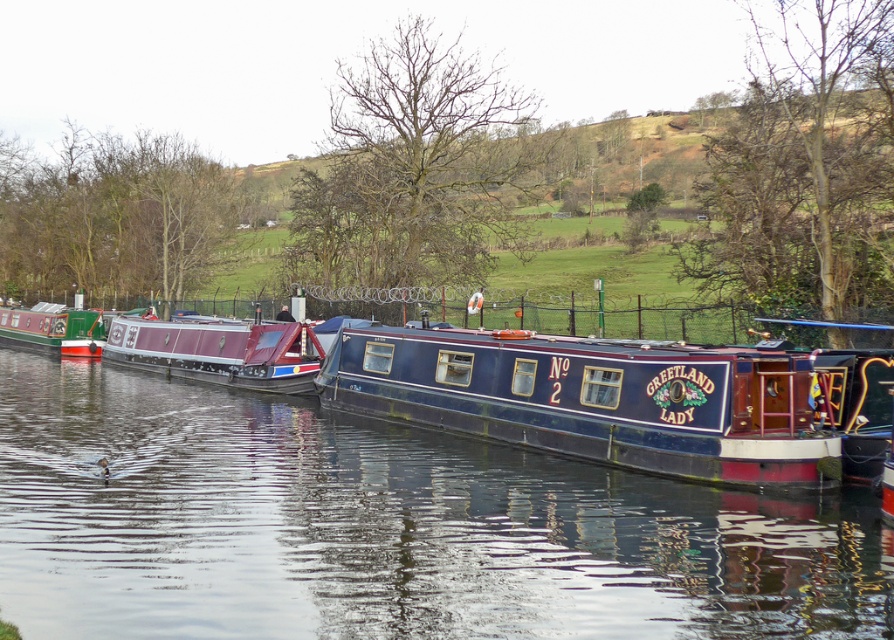
You are planning to load a large cargo onto the maroon polished wood boat at center and the green matte canal boat at left. Based on their sizes, which boat can accommodate the cargo more comfortably?

The maroon polished wood boat at center is larger in size than the green matte canal boat at left, so it can accommodate the cargo more comfortably.

You are a tour guide leading a group along the canal path. You need to move a 10 meter long tour boat between the maroon polished wood boat at center and the green matte canal boat at left. Is there enough space between them to safely maneuver the tour boat through?

The maroon polished wood boat at center and the green matte canal boat at left are 9.58 meters apart from each other. Since the tour boat is 10 meters long, there is not enough space to safely maneuver it between them.

You are standing on the dock and want to throw a pebble into the water near the green matte canal boat at left. Will the pebble land closer to you or farther away from you compared to the glossy blue water at center?

The glossy blue water at center is closer to the viewer than the green matte canal boat at left, so the pebble would land farther away from you compared to the glossy blue water at center.